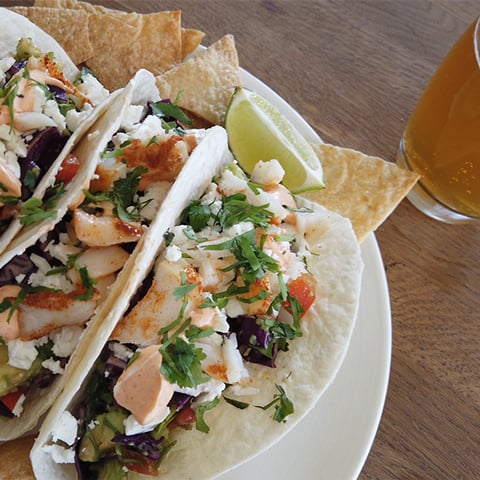
Locate an element on the screen. white plate is located at coordinates (307, 470).